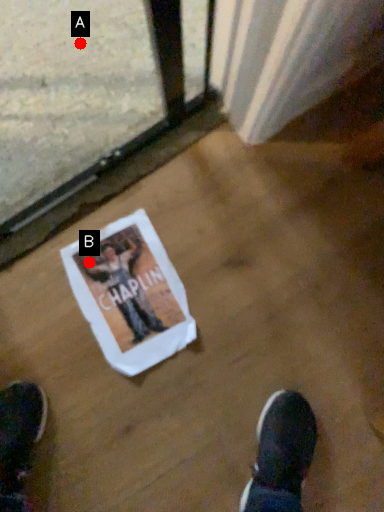
Question: Two points are circled on the image, labeled by A and B beside each circle. Which point is closer to the camera taking this photo?

Choices:
 (A) A is closer
 (B) B is closer

Answer: (B)